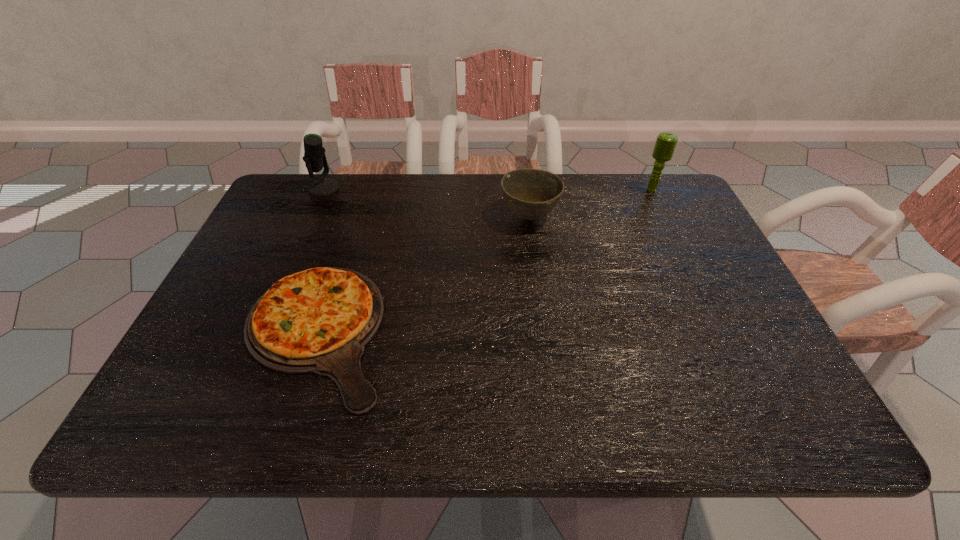
You are a GUI agent. You are given a task and a screenshot of the screen. Output one action in this format:
    pyautogui.click(x=<x>, y=<y>)
    Task: Click on the free space at the right edge of the desktop
    
    Given the screenshot: What is the action you would take?
    pos(711,279)

At what (x,y) coordinates should I click in order to perform the action: click on free location at the far left corner. Please return your answer as a coordinate pair (x, y). Looking at the image, I should click on (305, 194).

The width and height of the screenshot is (960, 540). What are the coordinates of `free space at the near left corner of the desktop` in the screenshot? It's located at (171, 400).

In the image, there is a desktop. Where is `free space at the far right corner`? The height and width of the screenshot is (540, 960). free space at the far right corner is located at coordinates (627, 186).

Image resolution: width=960 pixels, height=540 pixels. In order to click on vacant region at the near right corner in this screenshot , I will do `click(754, 413)`.

What are the coordinates of `vacant region between the left microphone and the third tallest object` in the screenshot? It's located at (426, 202).

You are a GUI agent. You are given a task and a screenshot of the screen. Output one action in this format:
    pyautogui.click(x=<x>, y=<y>)
    Task: Click on the empty location between the third tallest object and the rightmost object
    Image resolution: width=960 pixels, height=540 pixels.
    Given the screenshot: What is the action you would take?
    590,203

Locate an element on the screen. Image resolution: width=960 pixels, height=540 pixels. free area in between the second object from right to left and the pizza is located at coordinates (422, 274).

Find the location of a particular element. The height and width of the screenshot is (540, 960). free space that is in between the rightmost object and the left microphone is located at coordinates (488, 189).

The width and height of the screenshot is (960, 540). In order to click on free spot between the rightmost object and the left microphone in this screenshot , I will do `click(488, 189)`.